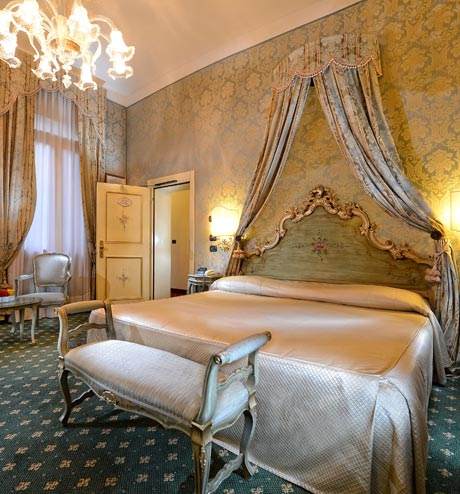
You are a GUI agent. You are given a task and a screenshot of the screen. Output one action in this format:
    pyautogui.click(x=<x>, y=<y>)
    Task: Click on the 1 window
    The height and width of the screenshot is (494, 460).
    Given the screenshot: What is the action you would take?
    pyautogui.click(x=50, y=220)